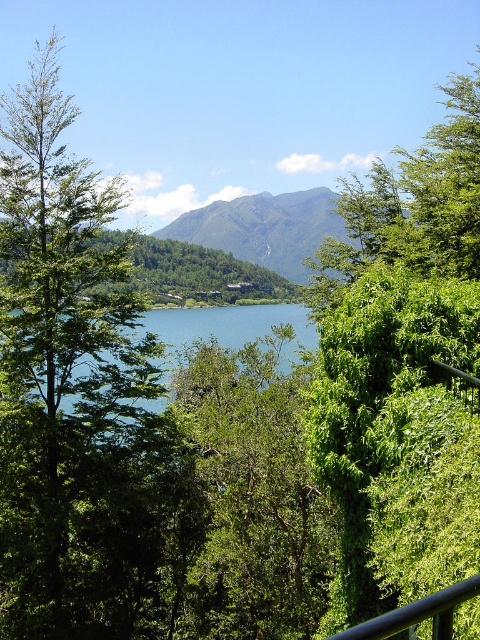
You are standing at point [248,497] in the serene natural landscape. What object is located exactly at your current position?

The green leafy tree at center is located exactly at point [248,497].

Based on the coordinates provided, where is the green leafy tree at left located in the image?

The green leafy tree at left is located at point [70,385] in the image.